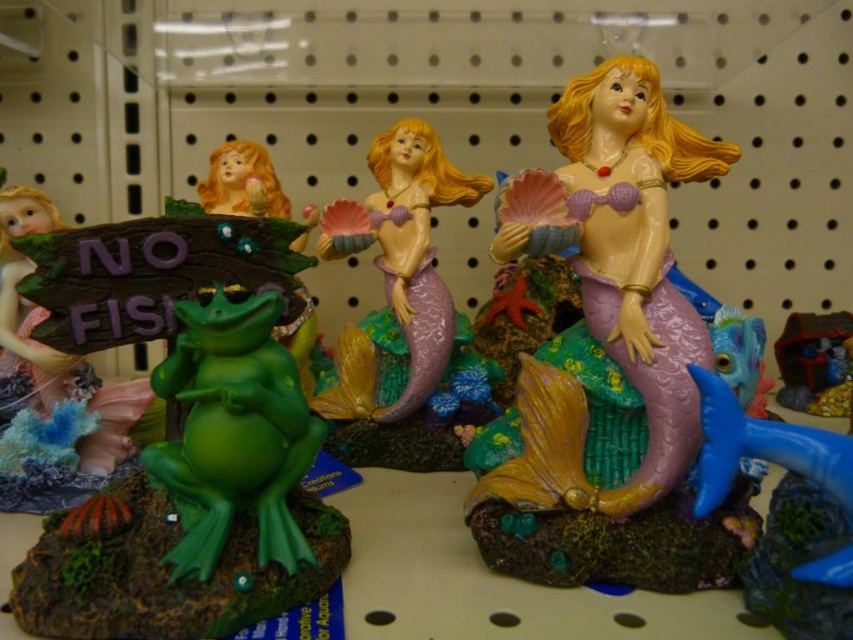
Who is more distant from viewer, (x=517, y=480) or (x=785, y=333)?

Point (x=785, y=333)

Can you confirm if matte pink mermaid at center is positioned above metallic gold treasure chest at upper center?

Correct, matte pink mermaid at center is located above metallic gold treasure chest at upper center.

Which is in front, point (585, 257) or point (851, 380)?

Point (585, 257)

The height and width of the screenshot is (640, 853). I want to click on matte pink mermaid at center, so click(618, 294).

Between point (546, 381) and point (322, 428), which one is positioned in front?

Point (322, 428) is more forward.

Which of these two, matte pink mermaid at center or green matte frog at center, stands shorter?

green matte frog at center is shorter.

Does point (582, 228) come in front of point (183, 362)?

No, (582, 228) is behind (183, 362).

In order to click on matte pink mermaid at center in this screenshot , I will do `click(618, 294)`.

Is purple matte mermaid at center bigger than matte green frog at left?

Actually, purple matte mermaid at center might be smaller than matte green frog at left.

Can you confirm if purple matte mermaid at center is positioned below matte green frog at left?

Actually, purple matte mermaid at center is above matte green frog at left.

Measure the distance between purple matte mermaid at center and camera.

1.06 meters

This screenshot has height=640, width=853. I want to click on purple matte mermaid at center, so click(x=402, y=275).